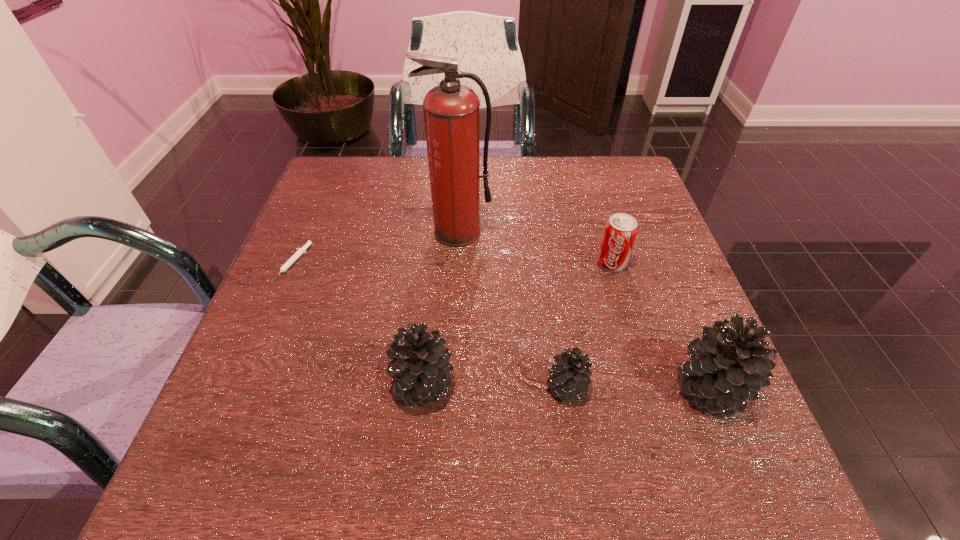
Please show where to add a pinecone on the left while keeping spacing even. Please provide its 2D coordinates. Your answer should be formatted as a tuple, i.e. [(x, y)], where the tuple contains the x and y coordinates of a point satisfying the conditions above.

[(280, 382)]